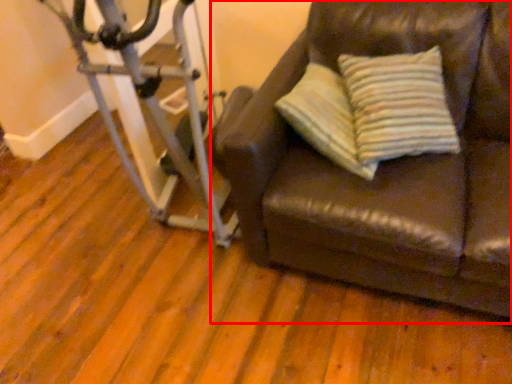
Question: From the image's perspective, where is studio couch (annotated by the red box) located relative to stationary bicycle?

Choices:
 (A) above
 (B) below

Answer: (B)